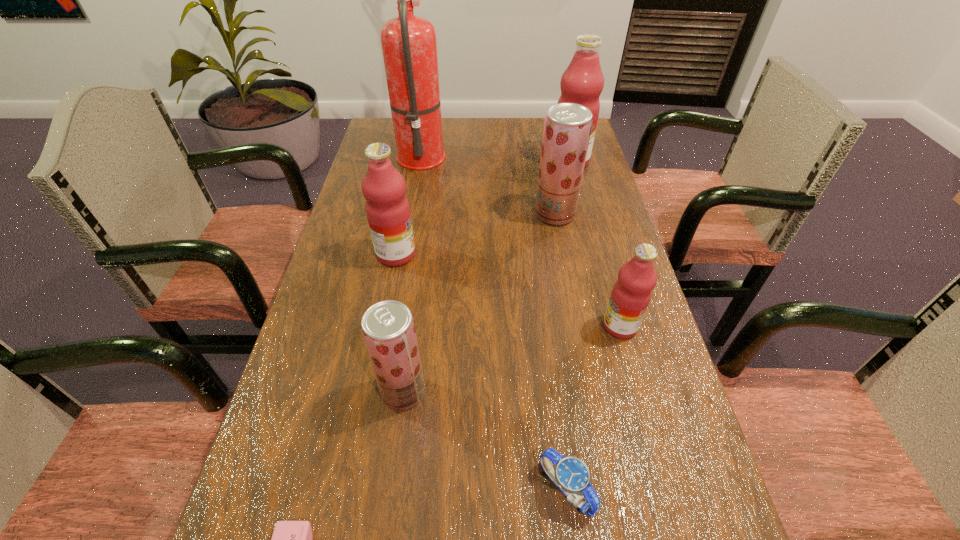
This screenshot has height=540, width=960. In order to click on the nearer strawberry fruit juice in this screenshot , I will do [x=388, y=328].

The height and width of the screenshot is (540, 960). I want to click on the third nearest object, so click(388, 328).

This screenshot has width=960, height=540. I want to click on the seventh tallest object, so click(x=571, y=476).

I want to click on the second nearest object, so click(x=571, y=476).

Where is `vacant space located 0.270m with the handle and hose on the red fire extinguisher`? vacant space located 0.270m with the handle and hose on the red fire extinguisher is located at coordinates (527, 153).

Find the location of a particular element. The height and width of the screenshot is (540, 960). free space located 0.090m on the label of the farthest pink fruit juice is located at coordinates (577, 190).

This screenshot has height=540, width=960. What are the coordinates of `blank space located 0.070m on the back of the sixth nearest object` in the screenshot? It's located at tap(550, 188).

This screenshot has height=540, width=960. In order to click on vacant space located on the label of the third farthest fruit juice in this screenshot , I will do `click(530, 254)`.

Locate an element on the screen. vacant area situated 0.350m on the label of the nearest pink fruit juice is located at coordinates (443, 326).

The height and width of the screenshot is (540, 960). Find the location of `vacant space situated 0.380m on the label of the nearest pink fruit juice`. vacant space situated 0.380m on the label of the nearest pink fruit juice is located at coordinates pyautogui.click(x=429, y=326).